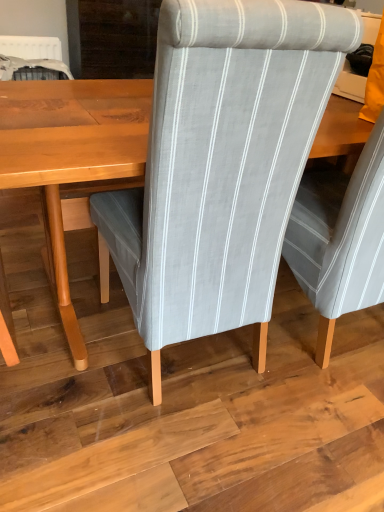
What do you see at coordinates (220, 166) in the screenshot?
I see `light gray fabric chair at center` at bounding box center [220, 166].

Find the location of a particular element. light gray fabric chair at center is located at coordinates (220, 166).

At what (x,y) coordinates should I click in order to perform the action: click on light gray fabric chair at center. Please return your answer as a coordinate pair (x, y). The width and height of the screenshot is (384, 512). Looking at the image, I should click on tap(220, 166).